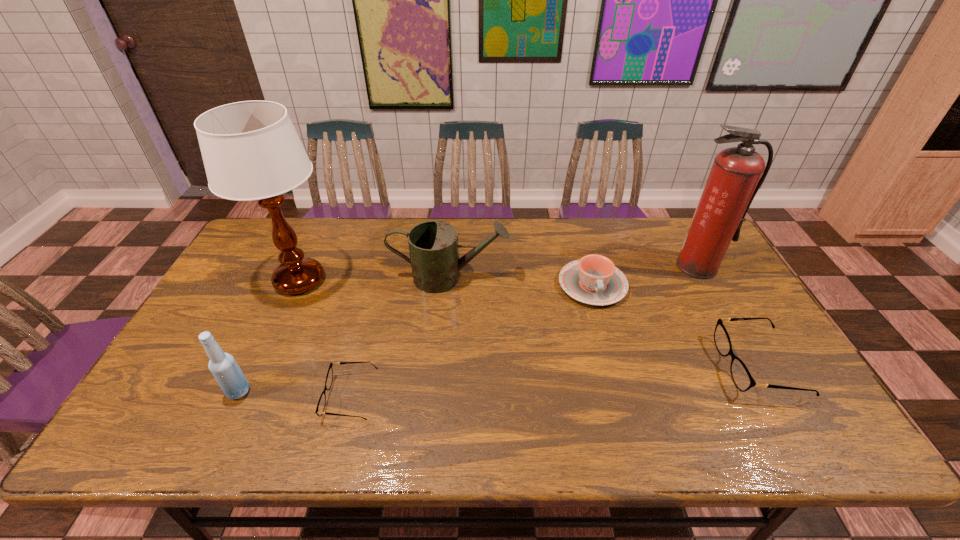
To make them evenly spaced by inserting another spectacles among them, please locate a free space for this new spectacles. Please provide its 2D coordinates. Your answer should be formatted as a tuple, i.e. [(x, y)], where the tuple contains the x and y coordinates of a point satisfying the conditions above.

[(561, 381)]